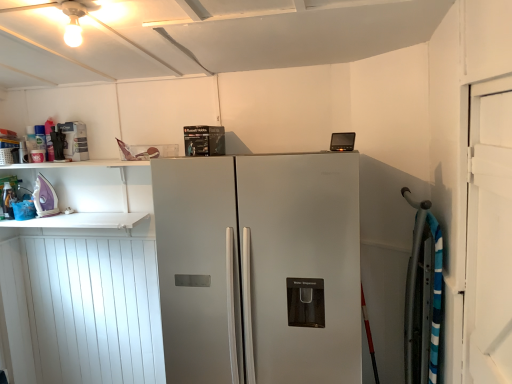
Question: From a real-world perspective, is matte white spray can at upper left, placed as the 1th appliance when sorted from right to left, physically below purple glossy iron at left, which is the 1th appliance from left to right?

Choices:
 (A) yes
 (B) no

Answer: (B)

Question: Is matte white spray can at upper left, the 2th appliance from the bottom, positioned far away from purple glossy iron at left, acting as the 1th appliance starting from the bottom?

Choices:
 (A) no
 (B) yes

Answer: (A)

Question: Considering the relative positions of matte white spray can at upper left, the 2th appliance from the bottom, and purple glossy iron at left, acting as the 1th appliance starting from the bottom, in the image provided, is matte white spray can at upper left, the 2th appliance from the bottom, to the left of purple glossy iron at left, acting as the 1th appliance starting from the bottom, from the viewer's perspective?

Choices:
 (A) no
 (B) yes

Answer: (A)

Question: Does matte white spray can at upper left, placed as the 1th appliance when sorted from right to left, turn towards purple glossy iron at left, acting as the second appliance starting from the right?

Choices:
 (A) no
 (B) yes

Answer: (A)

Question: From a real-world perspective, is matte white spray can at upper left, placed as the 1th appliance when sorted from right to left, located higher than purple glossy iron at left, which is the 1th appliance from left to right?

Choices:
 (A) yes
 (B) no

Answer: (A)

Question: Looking at their shapes, would you say purple glossy iron at left, acting as the second appliance starting from the right, is wider or thinner than white wood door at right?

Choices:
 (A) wide
 (B) thin

Answer: (A)

Question: Looking at the image, does purple glossy iron at left, which is the 1th appliance from left to right, seem bigger or smaller compared to white wood door at right?

Choices:
 (A) big
 (B) small

Answer: (B)

Question: Is purple glossy iron at left, acting as the 1th appliance starting from the bottom, inside the boundaries of white wood door at right, or outside?

Choices:
 (A) outside
 (B) inside

Answer: (A)

Question: Is purple glossy iron at left, acting as the second appliance starting from the right, in front of or behind white wood door at right in the image?

Choices:
 (A) front
 (B) behind

Answer: (B)

Question: From a real-world perspective, is satin silver refrigerator at center physically located above or below white wood door at right?

Choices:
 (A) below
 (B) above

Answer: (A)

Question: Based on their sizes in the image, would you say satin silver refrigerator at center is bigger or smaller than white wood door at right?

Choices:
 (A) big
 (B) small

Answer: (A)

Question: Relative to white wood door at right, is satin silver refrigerator at center in front or behind?

Choices:
 (A) behind
 (B) front

Answer: (A)

Question: From the image's perspective, is satin silver refrigerator at center located above or below white wood door at right?

Choices:
 (A) below
 (B) above

Answer: (A)

Question: In the image, is satin silver refrigerator at center positioned in front of or behind purple glossy iron at left, which is the 1th appliance from left to right?

Choices:
 (A) front
 (B) behind

Answer: (A)

Question: From a real-world perspective, is satin silver refrigerator at center positioned above or below purple glossy iron at left, which is the 2th appliance from top to bottom?

Choices:
 (A) below
 (B) above

Answer: (A)